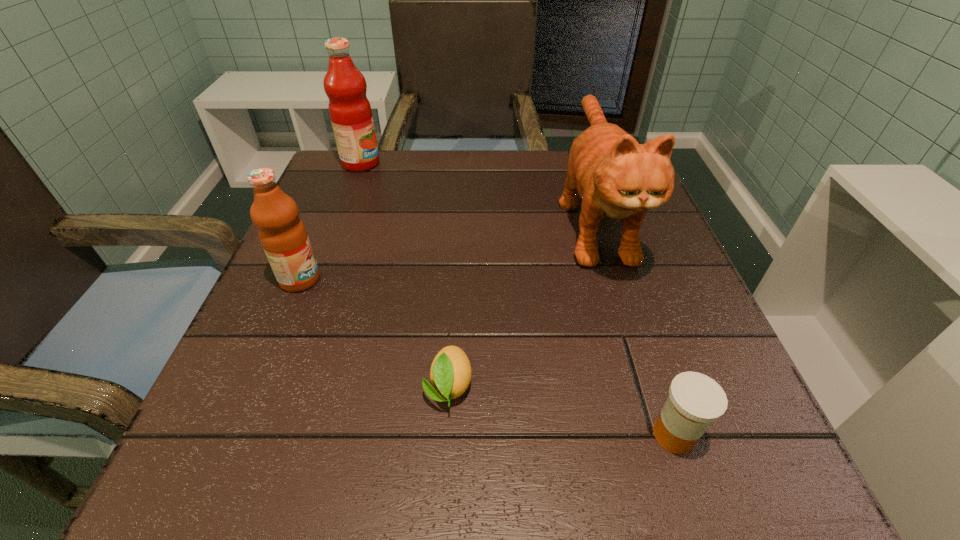
Where is `free location located 0.050m on the label of the second shortest object`? free location located 0.050m on the label of the second shortest object is located at coordinates (612, 435).

Identify the location of vacant space situated on the label of the second shortest object. (441, 435).

Where is `vacant space located on the label of the second shortest object`? This screenshot has width=960, height=540. vacant space located on the label of the second shortest object is located at coordinates (486, 435).

Where is `free space located 0.080m with leaves positioned above the shortest object`? This screenshot has width=960, height=540. free space located 0.080m with leaves positioned above the shortest object is located at coordinates (443, 477).

Image resolution: width=960 pixels, height=540 pixels. In order to click on fruit juice that is positioned at the far edge in this screenshot , I will do click(x=350, y=112).

Find the location of a particular element. The width and height of the screenshot is (960, 540). cat located in the far edge section of the desktop is located at coordinates (615, 176).

Find the location of a particular element. object located in the near edge section of the desktop is located at coordinates (695, 400).

You are a GUI agent. You are given a task and a screenshot of the screen. Output one action in this format:
    pyautogui.click(x=<x>, y=<y>)
    Task: Click on the cat that is at the right edge
    The image size is (960, 540).
    Given the screenshot: What is the action you would take?
    pyautogui.click(x=615, y=176)

At what (x,y) coordinates should I click in order to perform the action: click on medicine positioned at the right edge. Please return your answer as a coordinate pair (x, y). Looking at the image, I should click on (695, 400).

Where is `object at the far left corner`? The width and height of the screenshot is (960, 540). object at the far left corner is located at coordinates (350, 112).